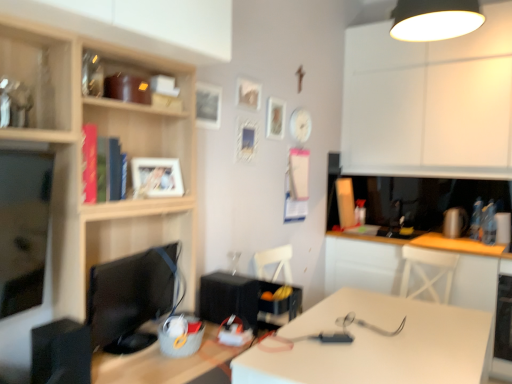
Question: Which direction should I rotate to face white matte picture frame at upper center, the 4th picture frame viewed from the left, — up or down?

Choices:
 (A) up
 (B) down

Answer: (A)

Question: Does black plastic speaker at left, the 1th appliance viewed from the left, appear on the right side of white matte picture frame at upper center, which appears as the 3th picture frame when viewed from the back?

Choices:
 (A) no
 (B) yes

Answer: (A)

Question: Is black plastic speaker at left, which is counted as the second appliance, starting from the right, behind white matte picture frame at upper center, the 4th picture frame viewed from the left?

Choices:
 (A) yes
 (B) no

Answer: (B)

Question: From the image's perspective, would you say black plastic speaker at left, which ranks as the second appliance in back-to-front order, is positioned over white matte picture frame at upper center, placed as the second picture frame when sorted from right to left?

Choices:
 (A) yes
 (B) no

Answer: (B)

Question: From the image's perspective, does black plastic speaker at left, the 1th appliance viewed from the left, appear lower than white matte picture frame at upper center, which appears as the 3th picture frame when viewed from the back?

Choices:
 (A) no
 (B) yes

Answer: (B)

Question: Does black plastic speaker at left, which ranks as the second appliance in back-to-front order, appear on the left side of white matte picture frame at upper center, the 4th picture frame viewed from the left?

Choices:
 (A) yes
 (B) no

Answer: (A)

Question: Is black plastic speaker at left, the 1th appliance viewed from the left, taller than white matte picture frame at upper center, which appears as the 3th picture frame when viewed from the back?

Choices:
 (A) no
 (B) yes

Answer: (B)

Question: Is white matte desk at center bigger than wooden picture frame at upper center, which is counted as the first picture frame, starting from the right?

Choices:
 (A) yes
 (B) no

Answer: (A)

Question: Is white matte desk at center positioned far away from wooden picture frame at upper center, the 1th picture frame in the back-to-front sequence?

Choices:
 (A) no
 (B) yes

Answer: (B)

Question: From the image's perspective, is white matte desk at center located above wooden picture frame at upper center, the fifth picture frame from the left?

Choices:
 (A) yes
 (B) no

Answer: (B)

Question: Considering the relative sizes of white matte desk at center and wooden picture frame at upper center, which is counted as the first picture frame, starting from the right, in the image provided, is white matte desk at center thinner than wooden picture frame at upper center, which is counted as the first picture frame, starting from the right,?

Choices:
 (A) yes
 (B) no

Answer: (B)

Question: Can you confirm if white matte desk at center is shorter than wooden picture frame at upper center, the 1th picture frame in the back-to-front sequence?

Choices:
 (A) yes
 (B) no

Answer: (B)

Question: Considering the relative sizes of white matte desk at center and wooden picture frame at upper center, the 5th picture frame in the front-to-back sequence, in the image provided, is white matte desk at center smaller than wooden picture frame at upper center, the 5th picture frame in the front-to-back sequence,?

Choices:
 (A) yes
 (B) no

Answer: (B)

Question: Is the depth of white matte desk at center less than that of white glossy table at lower right?

Choices:
 (A) no
 (B) yes

Answer: (B)